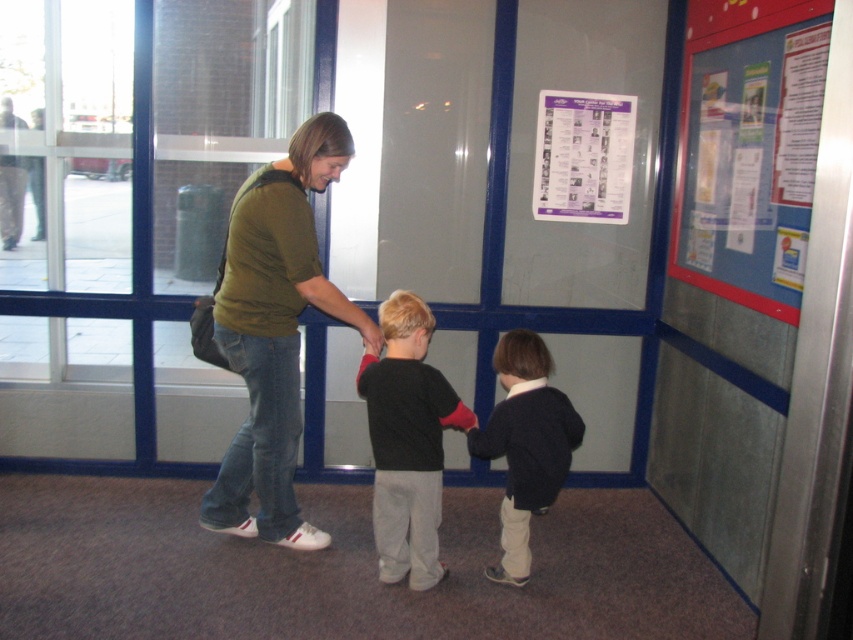
You are a visitor in this public building and want to place a large poster on the blue fabric bulletin board at upper right. However, you notice there is already a dark blue sweater at center hanging nearby. Considering their sizes, do you think the bulletin board can accommodate the poster without overlapping the sweater?

The blue fabric bulletin board at upper right has a lesser width compared to the dark blue sweater at center, so the bulletin board is narrower. Since the sweater is wider, placing a large poster on the bulletin board might cause it to overlap with the sweater unless adjusted carefully.